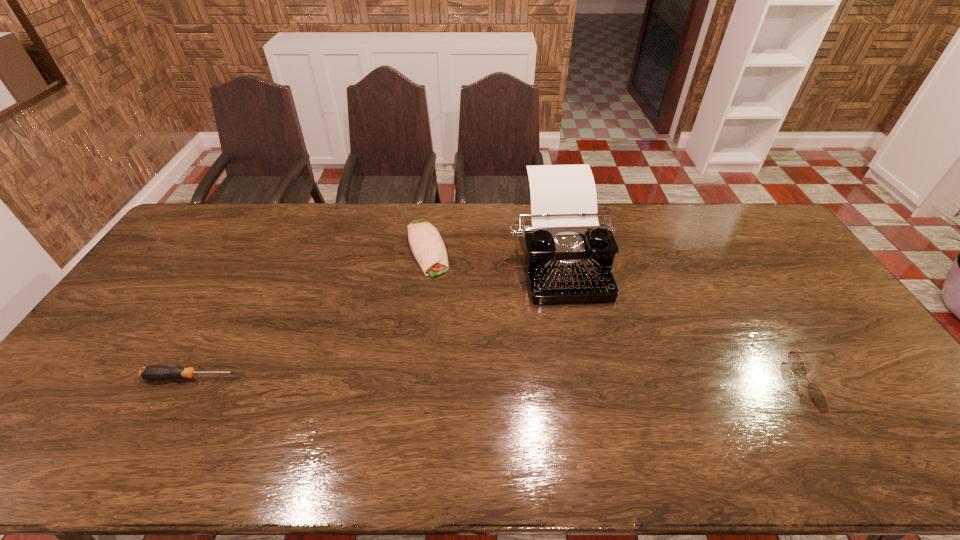
Find the location of `free space on the desktop that is between the screwdriver and the sunglasses and is positioned at the bitten end of the third object from right to left`. free space on the desktop that is between the screwdriver and the sunglasses and is positioned at the bitten end of the third object from right to left is located at coordinates (479, 381).

Where is `vacant space on the desktop that is between the screwdriver and the rightmost object and is positioned on the keys of the second object from right to left`? The image size is (960, 540). vacant space on the desktop that is between the screwdriver and the rightmost object and is positioned on the keys of the second object from right to left is located at coordinates (591, 383).